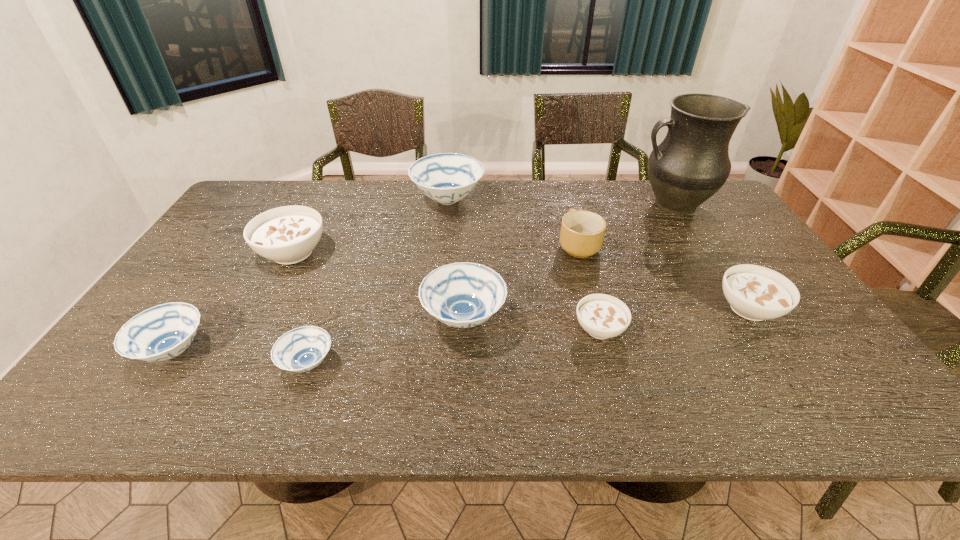
Image resolution: width=960 pixels, height=540 pixels. What are the coordinates of `object at the left edge` in the screenshot? It's located at (163, 332).

You are a GUI agent. You are given a task and a screenshot of the screen. Output one action in this format:
    pyautogui.click(x=<x>, y=<y>)
    Task: Click on the pitcher present at the right edge
    This screenshot has height=540, width=960.
    Given the screenshot: What is the action you would take?
    pyautogui.click(x=691, y=164)

Image resolution: width=960 pixels, height=540 pixels. Find the location of `soup bowl situated at the right edge`. soup bowl situated at the right edge is located at coordinates (756, 293).

I want to click on object present at the far right corner, so click(x=691, y=164).

In the image, there is a desktop. Where is `free space at the far edge`? The height and width of the screenshot is (540, 960). free space at the far edge is located at coordinates (361, 182).

Where is `vacant region at the left edge`? This screenshot has width=960, height=540. vacant region at the left edge is located at coordinates (174, 298).

You are a GUI agent. You are given a task and a screenshot of the screen. Output one action in this format:
    pyautogui.click(x=<x>, y=<y>)
    Task: Click on the free spot at the right edge of the desktop
    This screenshot has width=960, height=540.
    Given the screenshot: What is the action you would take?
    pyautogui.click(x=721, y=259)

Image resolution: width=960 pixels, height=540 pixels. Find the location of `free point at the far right corner`. free point at the far right corner is located at coordinates (692, 213).

Locate an element on the screen. This screenshot has width=960, height=540. vacant area between the biggest white soup bowl and the tallest object is located at coordinates (483, 228).

You are a GUI agent. You are given a task and a screenshot of the screen. Output one action in this format:
    pyautogui.click(x=<x>, y=<y>)
    Task: Click on the free space between the second white soup bowl from left to right and the rightmost white soup bowl
    Image resolution: width=960 pixels, height=540 pixels.
    Given the screenshot: What is the action you would take?
    pyautogui.click(x=674, y=319)